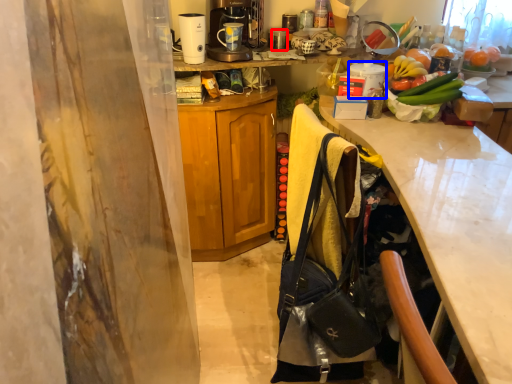
Question: Which object is further to the camera taking this photo, appliance (highlighted by a red box) or appliance (highlighted by a blue box)?

Choices:
 (A) appliance
 (B) appliance

Answer: (A)